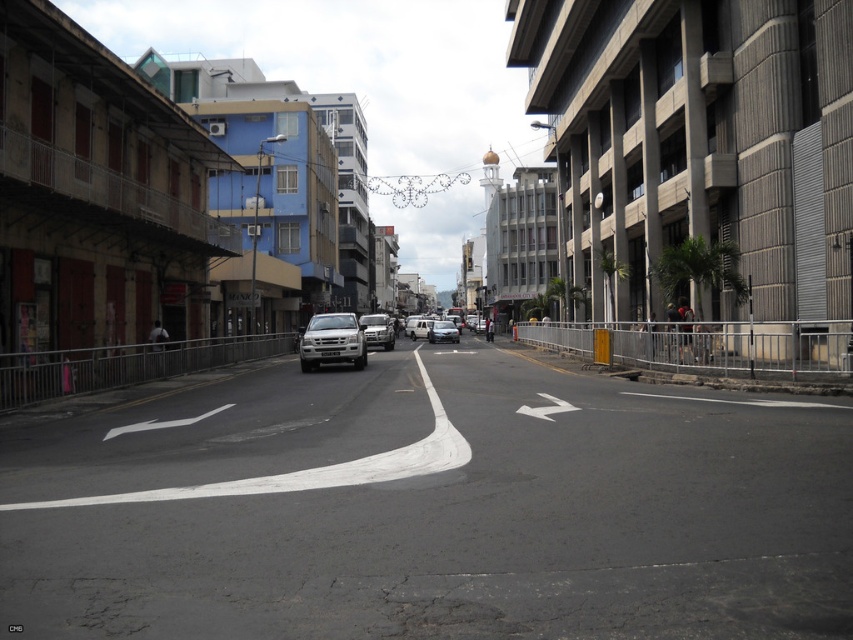
Question: Does white asphalt curve at center have a larger size compared to metallic silver car at center?

Choices:
 (A) yes
 (B) no

Answer: (B)

Question: From the image, what is the correct spatial relationship of silver metallic suv at center in relation to silver metallic car at center?

Choices:
 (A) below
 (B) above

Answer: (A)

Question: Which object is positioned farthest from the white asphalt curve at center?

Choices:
 (A) silver metallic suv at center
 (B) metallic silver car at center
 (C) white matte van at center

Answer: (C)

Question: Can you confirm if silver metallic suv at center is wider than silver metallic car at center?

Choices:
 (A) no
 (B) yes

Answer: (B)

Question: Which of the following is the farthest from the observer?

Choices:
 (A) silver metallic suv at center
 (B) metallic silver car at center

Answer: (B)

Question: Which point is closer to the camera taking this photo?

Choices:
 (A) (360, 461)
 (B) (408, 330)
 (C) (347, 355)
 (D) (364, 328)

Answer: (A)